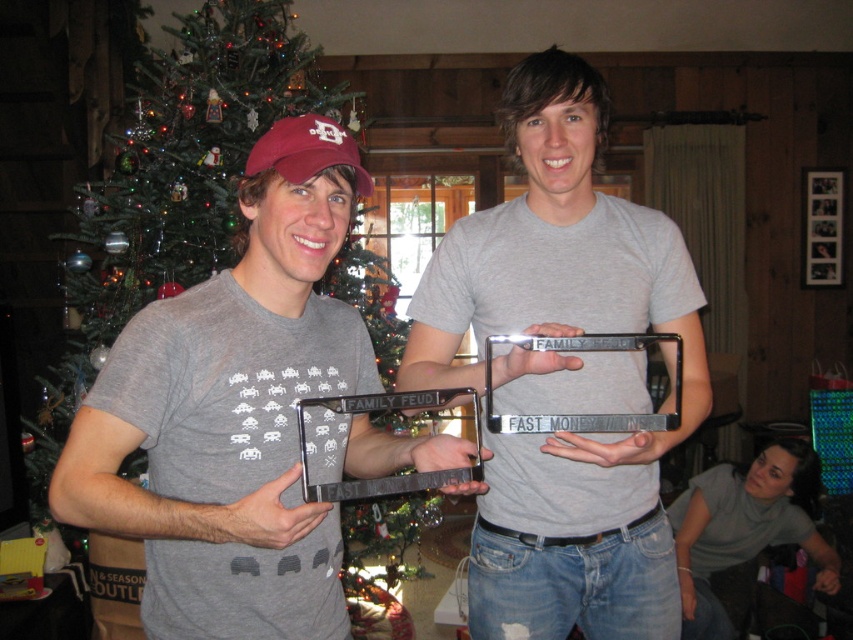
You are planning to take a photo of the green matte christmas tree at upper left and the gray cotton shirt at lower right. Which object should you focus on first if you want to capture both in a single frame without moving the camera?

The green matte christmas tree at upper left should be focused on first because it is wider than the gray cotton shirt at lower right, so ensuring it fits properly will help both objects be in the frame.